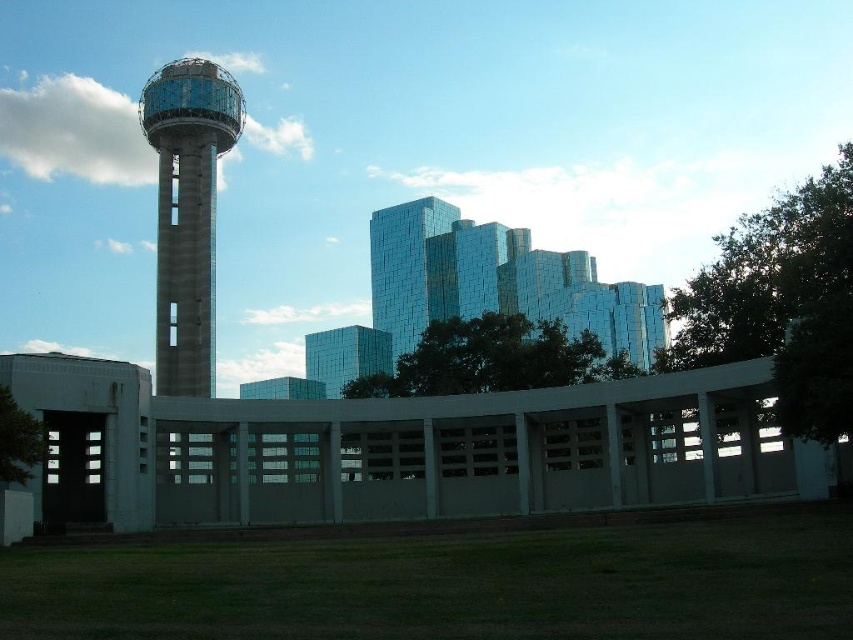
Is concrete water tower at left below glossy glass building at center?

Incorrect, concrete water tower at left is not positioned below glossy glass building at center.

Is concrete water tower at left smaller than glossy glass building at center?

Indeed, concrete water tower at left has a smaller size compared to glossy glass building at center.

You are a GUI agent. You are given a task and a screenshot of the screen. Output one action in this format:
    pyautogui.click(x=<x>, y=<y>)
    Task: Click on the concrete water tower at left
    
    Given the screenshot: What is the action you would take?
    pyautogui.click(x=187, y=212)

In order to click on concrete water tower at left in this screenshot , I will do `click(187, 212)`.